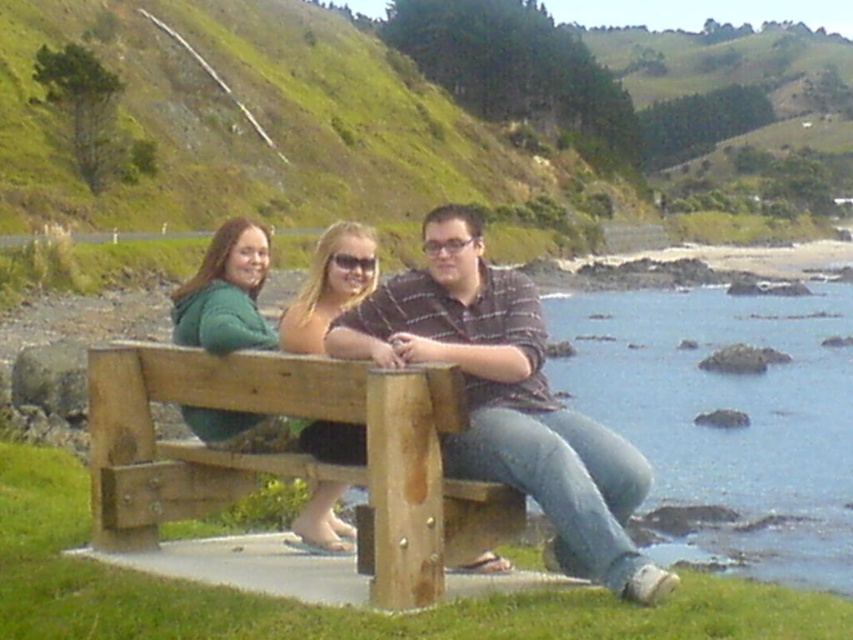
Question: Which point is farther from the camera taking this photo?

Choices:
 (A) (833, 332)
 (B) (141, 444)
 (C) (344, 552)
 (D) (175, 120)

Answer: (D)

Question: Does green grassy hillside at upper center appear under clear blue water at lower right?

Choices:
 (A) no
 (B) yes

Answer: (A)

Question: Which point is closer to the camera?

Choices:
 (A) (61, 24)
 (B) (428, 212)
 (C) (239, 228)
 (D) (102, 410)

Answer: (D)

Question: Is wooden bench at center below striped cotton shirt at center?

Choices:
 (A) no
 (B) yes

Answer: (A)

Question: In this image, where is striped cotton shirt at center located relative to green fleece jacket at left?

Choices:
 (A) above
 (B) below

Answer: (B)

Question: Among these objects, which one is farthest from the camera?

Choices:
 (A) green grassy hillside at upper center
 (B) green fleece jacket at left
 (C) wooden bench at center
 (D) clear blue water at lower right

Answer: (A)